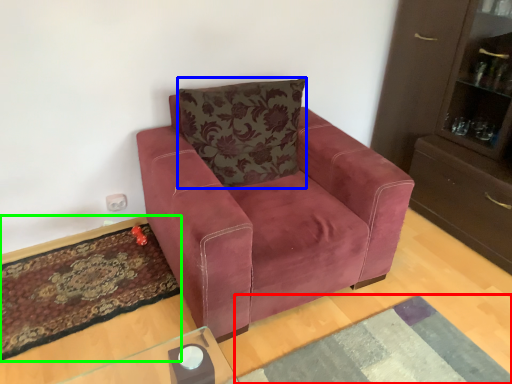
Question: Which object is the farthest from mat (highlighted by a red box)? Choose among these: pillow (highlighted by a blue box) or mat (highlighted by a green box).

Choices:
 (A) pillow
 (B) mat

Answer: (A)